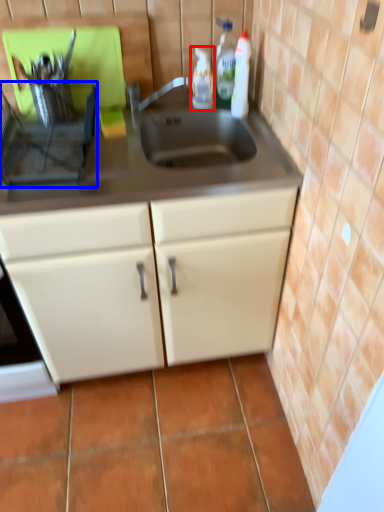
Question: Which object appears closest to the camera in this image, bottle (highlighted by a red box) or appliance (highlighted by a blue box)?

Choices:
 (A) bottle
 (B) appliance

Answer: (B)